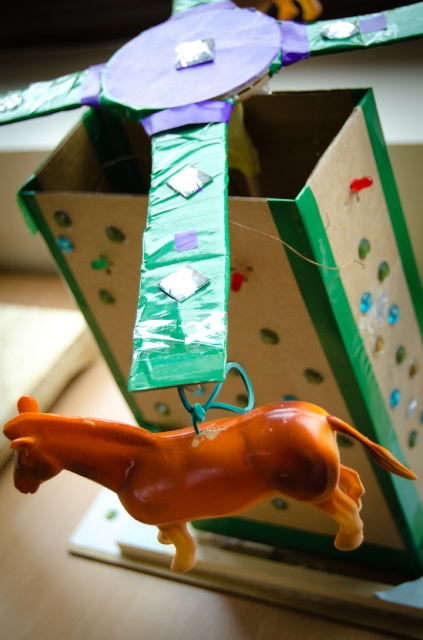
Measure the distance between green cardboard box at center and orange glossy horse at lower center.

A distance of 12.54 inches exists between green cardboard box at center and orange glossy horse at lower center.

Is point (230, 262) behind point (147, 452)?

Yes, it is.

Which is behind, point (145, 392) or point (294, 468)?

The point (145, 392) is behind.

Identify the location of green cardboard box at center. This screenshot has width=423, height=640. (324, 266).